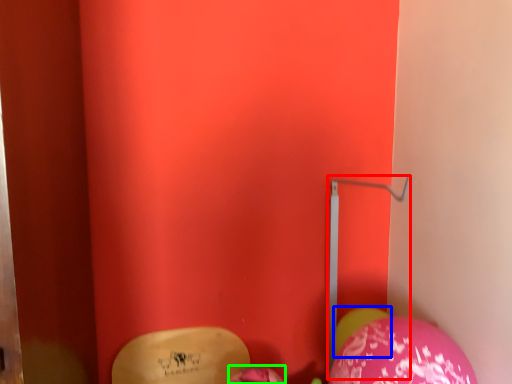
Question: Estimate the real-world distances between objects in this image. Which object is farther from trim (highlighted by a red box), balloon (highlighted by a blue box) or balloon (highlighted by a green box)?

Choices:
 (A) balloon
 (B) balloon

Answer: (B)